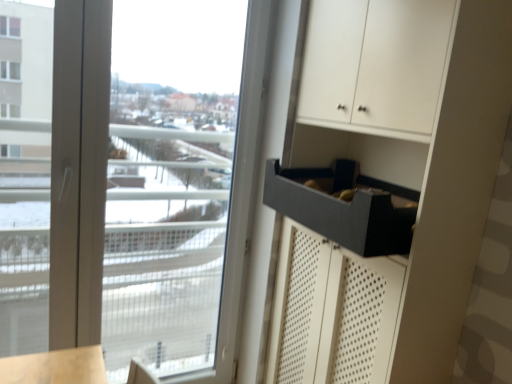
Question: In terms of size, does matte black drawer at right appear bigger or smaller than matte gray drawer at lower right?

Choices:
 (A) small
 (B) big

Answer: (B)

Question: Considering the positions of matte black drawer at right and matte gray drawer at lower right in the image, is matte black drawer at right wider or thinner than matte gray drawer at lower right?

Choices:
 (A) thin
 (B) wide

Answer: (A)

Question: Which is nearer to the matte black drawer at right?

Choices:
 (A) transparent glass window at upper left
 (B) matte gray drawer at lower right

Answer: (B)

Question: Considering the real-world distances, which object is closest to the matte gray drawer at lower right?

Choices:
 (A) transparent glass window at upper left
 (B) matte black drawer at right

Answer: (B)